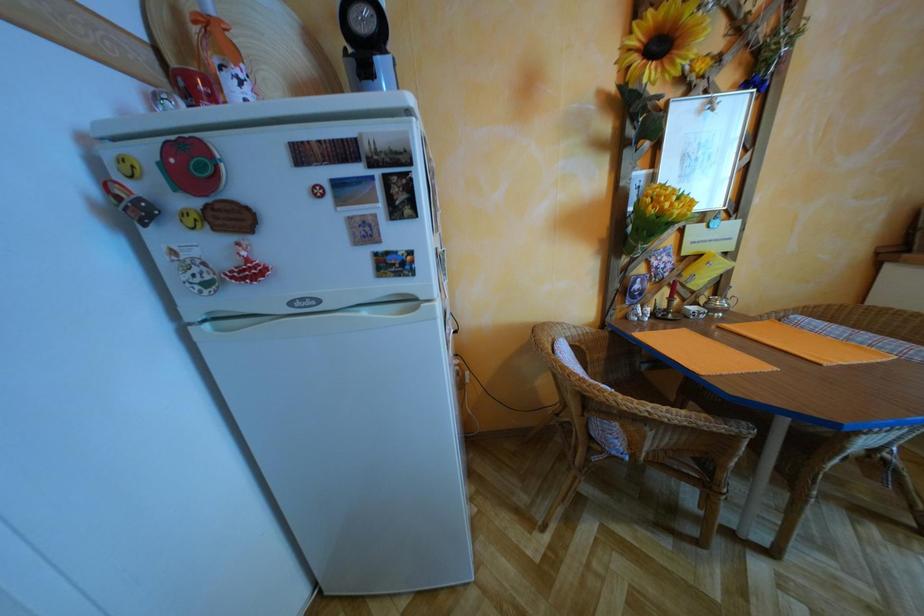
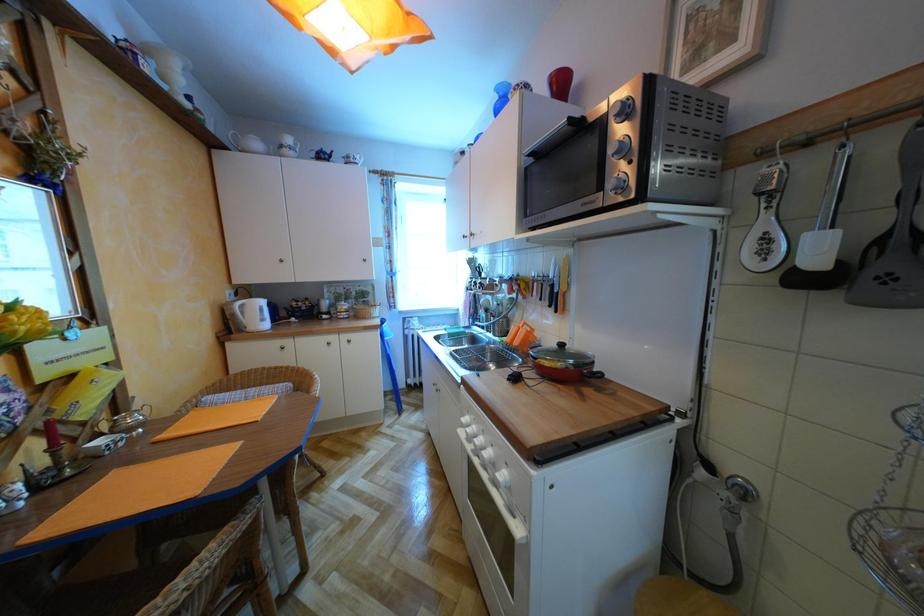
Question: The first image is from the beginning of the video and the second image is from the end. How did the camera likely rotate when shooting the video?

Choices:
 (A) Left
 (B) Right
 (C) Up
 (D) Down

Answer: (B)